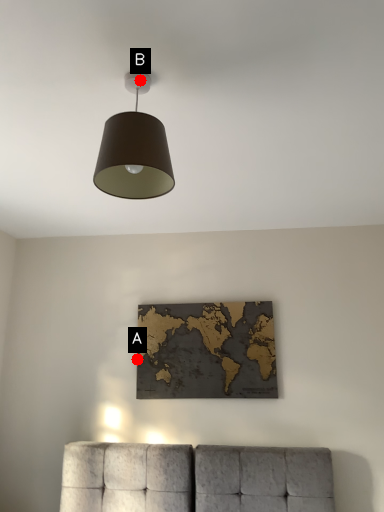
Question: Two points are circled on the image, labeled by A and B beside each circle. Which point is closer to the camera?

Choices:
 (A) A is closer
 (B) B is closer

Answer: (B)